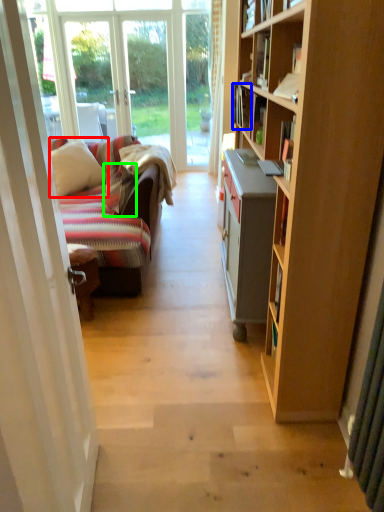
Question: Estimate the real-world distances between objects in this image. Which object is closer to pillow (highlighted by a red box), book (highlighted by a blue box) or pillow (highlighted by a green box)?

Choices:
 (A) book
 (B) pillow

Answer: (B)